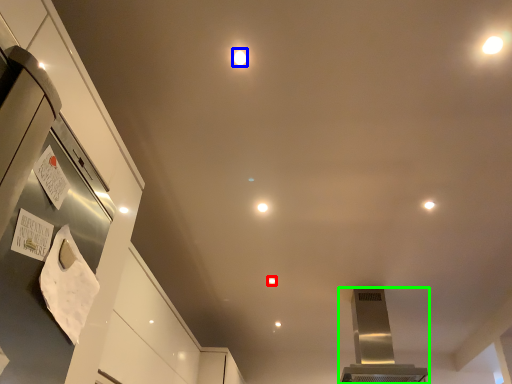
Question: Which is nearer to the light (highlighted by a red box)? light (highlighted by a blue box) or home appliance (highlighted by a green box).

Choices:
 (A) light
 (B) home appliance

Answer: (B)